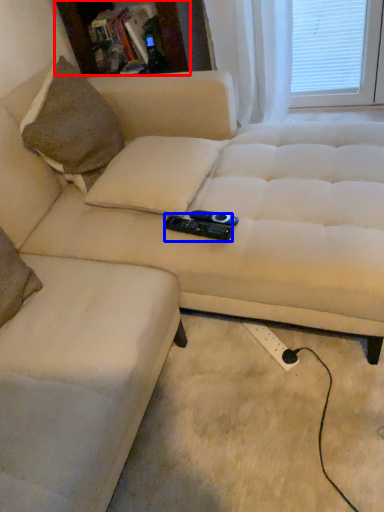
Question: Which of the following is the farthest to the observer, bookshelf (highlighted by a red box) or remote (highlighted by a blue box)?

Choices:
 (A) bookshelf
 (B) remote

Answer: (A)